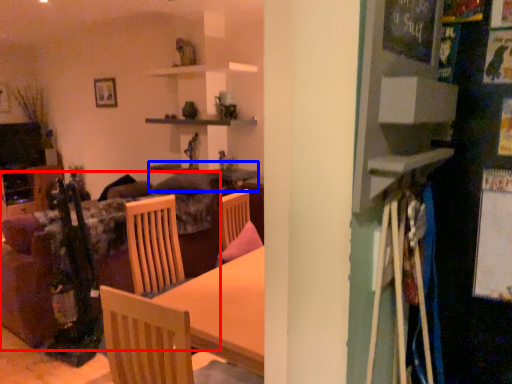
Question: Among these objects, which one is nearest to the camera, couch (highlighted by a red box) or table (highlighted by a blue box)?

Choices:
 (A) couch
 (B) table

Answer: (A)